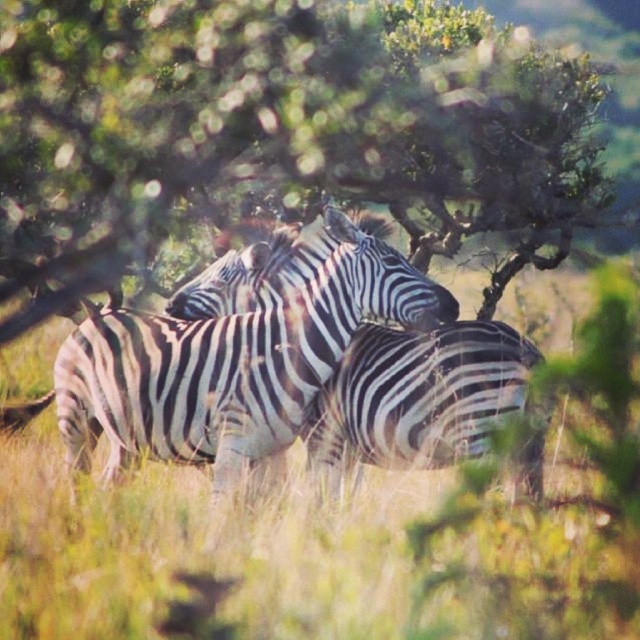
Question: Considering the relative positions of green grass at center and black and white striped zebra at center in the image provided, where is green grass at center located with respect to black and white striped zebra at center?

Choices:
 (A) below
 (B) above

Answer: (B)

Question: Which object is closer to the camera taking this photo?

Choices:
 (A) black and white striped zebra at center
 (B) green grass at center

Answer: (B)

Question: Which point is farther to the camera?

Choices:
 (A) green leafy tree at center
 (B) green grass at center
 (C) black and white striped zebra at center

Answer: (A)

Question: Does green grass at center appear on the left side of black and white striped zebra at center?

Choices:
 (A) yes
 (B) no

Answer: (A)

Question: Which object is positioned farthest from the green leafy tree at center?

Choices:
 (A) green grass at center
 (B) black and white striped zebra at center

Answer: (A)

Question: Can you confirm if green leafy tree at center is positioned to the right of green grass at center?

Choices:
 (A) yes
 (B) no

Answer: (A)